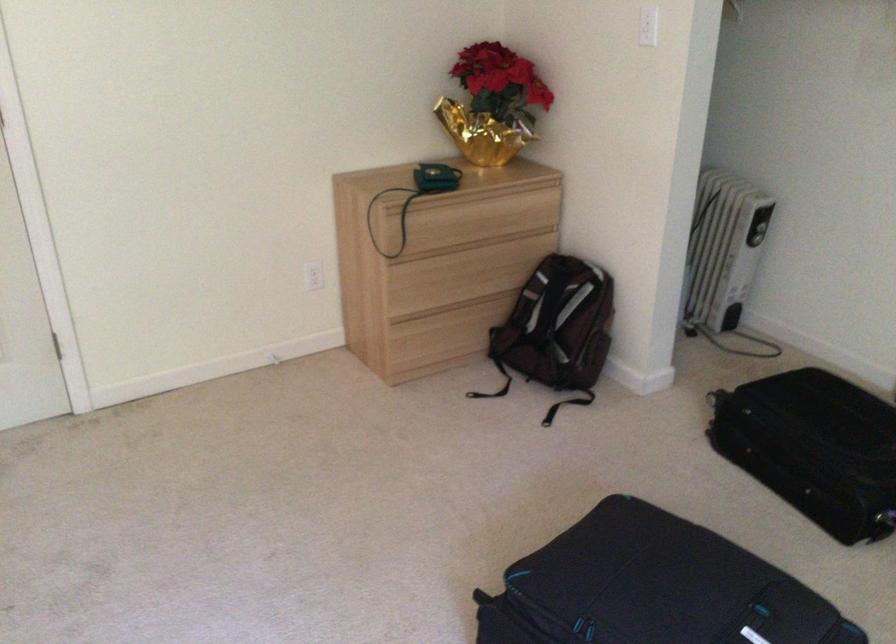
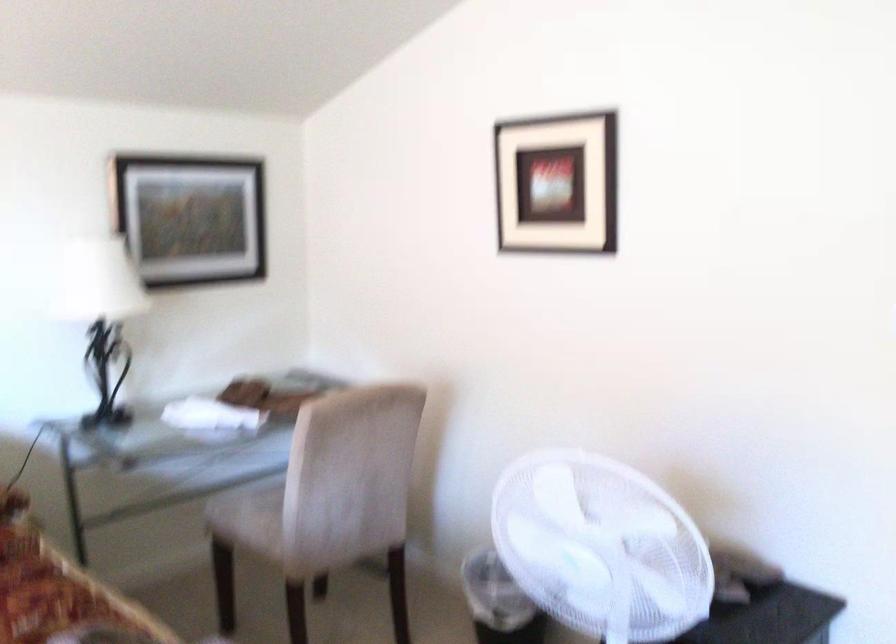
Question: The camera is either moving clockwise (left) or counter-clockwise (right) around the object. The first image is from the beginning of the video and the second image is from the end. Is the camera moving left or right when shooting the video?

Choices:
 (A) Left
 (B) Right

Answer: (B)